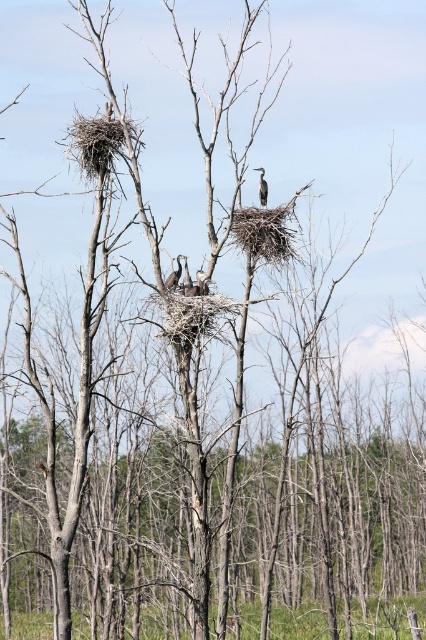
Question: Which point appears farthest from the camera in this image?

Choices:
 (A) (184, 259)
 (B) (262, 170)
 (C) (198, 285)

Answer: (B)

Question: Considering the relative positions of dark brown feathers at center and brown textured nest at center in the image provided, where is dark brown feathers at center located with respect to brown textured nest at center?

Choices:
 (A) left
 (B) right

Answer: (A)

Question: Which is farther from the brown textured nest at center?

Choices:
 (A) dark brown feathers at center
 (B) brown textured bird at center

Answer: (A)

Question: In this image, where is brown textured bird at center located relative to dark brown feathers at center?

Choices:
 (A) above
 (B) below

Answer: (B)

Question: Does dark brown feathers at center appear over gray feathered heron at center?

Choices:
 (A) no
 (B) yes

Answer: (A)

Question: Which point is closer to the camera?

Choices:
 (A) dark brown feathers at center
 (B) brown textured nest at center
 (C) brown textured bird at center

Answer: (A)